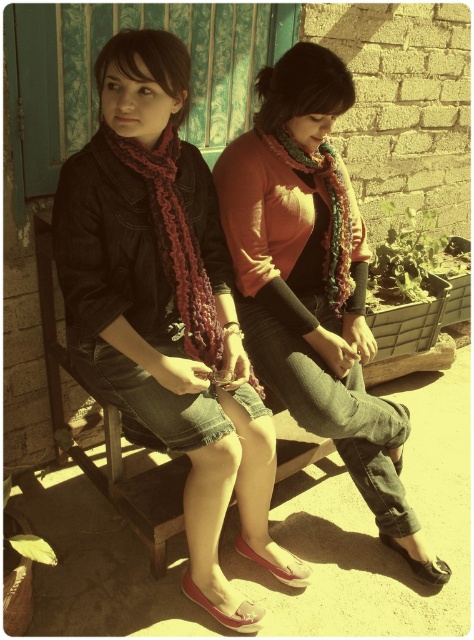
You are a fashion designer observing two scarves in the image. The ruffled wool scarf at left and the knitted scarf at center. Which scarf takes up more space in the image?

The knitted scarf at center takes up more space in the image than the ruffled wool scarf at left because the ruffled wool scarf at left occupies less space than knitted scarf at center.

You are a photographer standing at a certain distance from the scene. You want to capture a closeup shot of the ruffled wool scarf at left without moving the camera. Is the scarf within the camera lens range of 1.5 meters?

The ruffled wool scarf at left is 1.55 meters from camera, which is slightly beyond the 1.5 meters lens range. Therefore, the scarf might be out of focus or not fully in frame unless the camera adjusts its settings.

You are a photographer setting up a shot of the two people on the wooden bench. The multicolored knitted scarf at center is between them. If you want to ensure both people are in focus, what should you consider about their distance?

The two people are 2.05 meters apart, so to ensure both are in focus, the photographer should use a small aperture setting to increase the depth of field, allowing both subjects at different distances to be sharp.